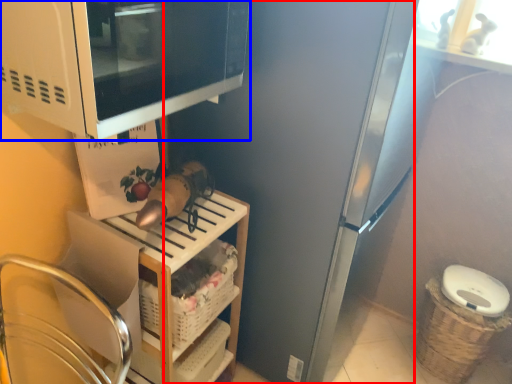
Question: Which point is further to the camera, appliance (highlighted by a red box) or microwave oven (highlighted by a blue box)?

Choices:
 (A) appliance
 (B) microwave oven

Answer: (A)